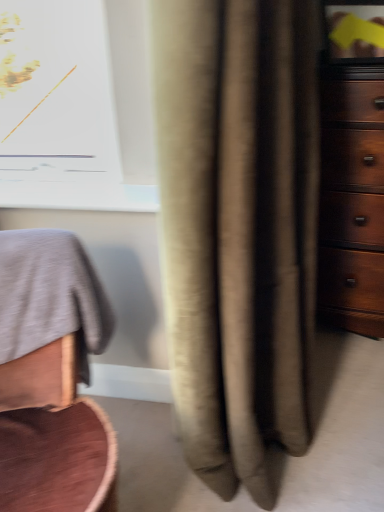
Question: Would you consider beige fabric curtain at center to be distant from dark wood dresser at right?

Choices:
 (A) yes
 (B) no

Answer: (B)

Question: Can you confirm if beige fabric curtain at center is wider than dark wood dresser at right?

Choices:
 (A) yes
 (B) no

Answer: (B)

Question: Is beige fabric curtain at center thinner than dark wood dresser at right?

Choices:
 (A) yes
 (B) no

Answer: (A)

Question: Is dark wood dresser at right surrounded by beige fabric curtain at center?

Choices:
 (A) no
 (B) yes

Answer: (A)

Question: From the image's perspective, is beige fabric curtain at center below dark wood dresser at right?

Choices:
 (A) yes
 (B) no

Answer: (A)

Question: Does beige fabric curtain at center appear on the left side of dark wood dresser at right?

Choices:
 (A) no
 (B) yes

Answer: (B)

Question: Considering the relative sizes of smooth gray fabric at left and dark wood dresser at right in the image provided, is smooth gray fabric at left bigger than dark wood dresser at right?

Choices:
 (A) yes
 (B) no

Answer: (B)

Question: Is dark wood dresser at right inside smooth gray fabric at left?

Choices:
 (A) yes
 (B) no

Answer: (B)

Question: From a real-world perspective, does smooth gray fabric at left sit lower than dark wood dresser at right?

Choices:
 (A) yes
 (B) no

Answer: (A)

Question: From the image's perspective, is smooth gray fabric at left above dark wood dresser at right?

Choices:
 (A) yes
 (B) no

Answer: (B)

Question: Are smooth gray fabric at left and dark wood dresser at right located far from each other?

Choices:
 (A) yes
 (B) no

Answer: (A)

Question: Considering the relative sizes of smooth gray fabric at left and dark wood dresser at right in the image provided, is smooth gray fabric at left wider than dark wood dresser at right?

Choices:
 (A) no
 (B) yes

Answer: (B)

Question: Does dark wood dresser at right lie in front of beige fabric curtain at center?

Choices:
 (A) no
 (B) yes

Answer: (A)